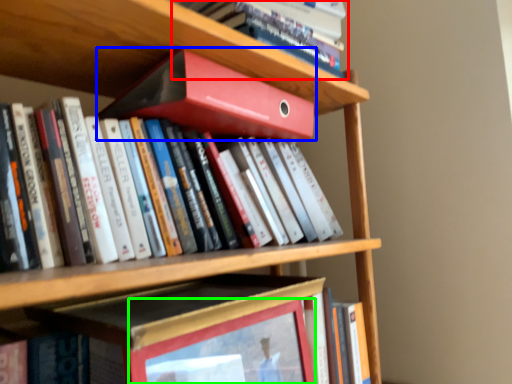
Question: Which is farther away from book (highlighted by a red box)? book (highlighted by a blue box) or picture frame (highlighted by a green box)?

Choices:
 (A) book
 (B) picture frame

Answer: (B)